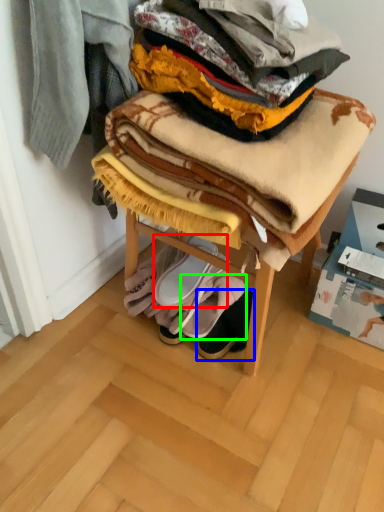
Question: Which object is the closest to the footwear (highlighted by a red box)? Choose among these: footwear (highlighted by a blue box) or footwear (highlighted by a green box).

Choices:
 (A) footwear
 (B) footwear

Answer: (B)